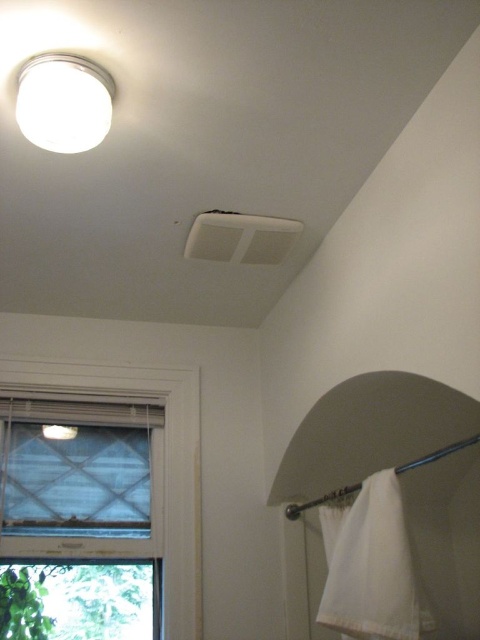
You are standing in the bathroom and want to open the white textured window at lower left. Based on its position, which direction should you walk to reach it?

The white textured window at lower left is located at point (x=164, y=456), so you should walk towards the lower left direction to reach it.

You are a robot trying to reach the white cotton towel at lower right in the bathroom. The robot can move in any direction except through solid objects. What is the shortest path the robot should take to reach the towel without passing through any walls or the shower curtain rod?

The robot should move directly towards the white cotton towel at lower right along a straight path since there are no obstacles blocking the way between the robot and the towel according to the scene description.

You are standing in the bathroom and want to hang a new shower curtain on the shower curtain rod. The rod is currently holding a white towel. Which object, the white textured window at lower left or the white matte light fixture at upper left, is closer to the rod where you will hang the curtain?

The white textured window at lower left is positioned under the white matte light fixture at upper left, so the window is closer to the rod. Therefore, the white textured window at lower left is closer to the rod where you will hang the curtain.